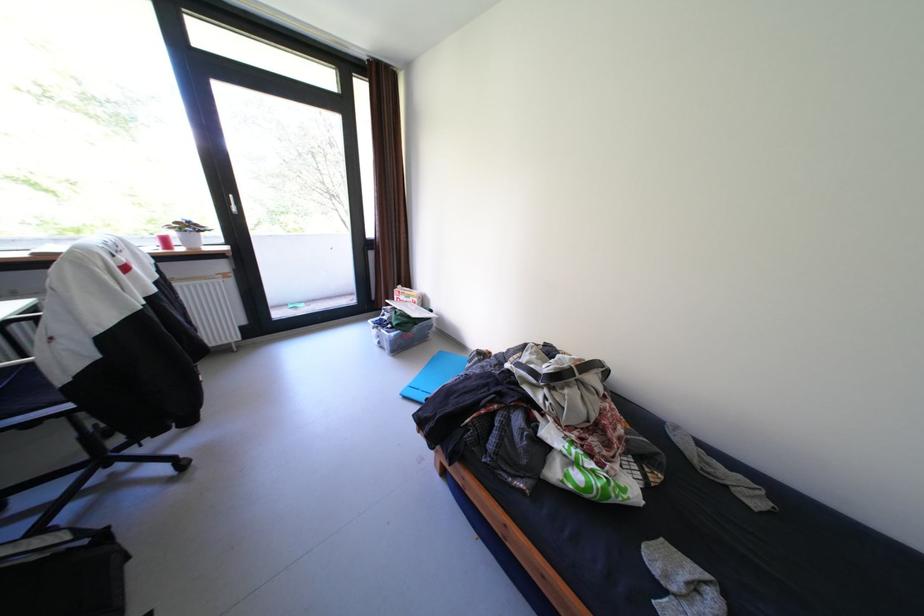
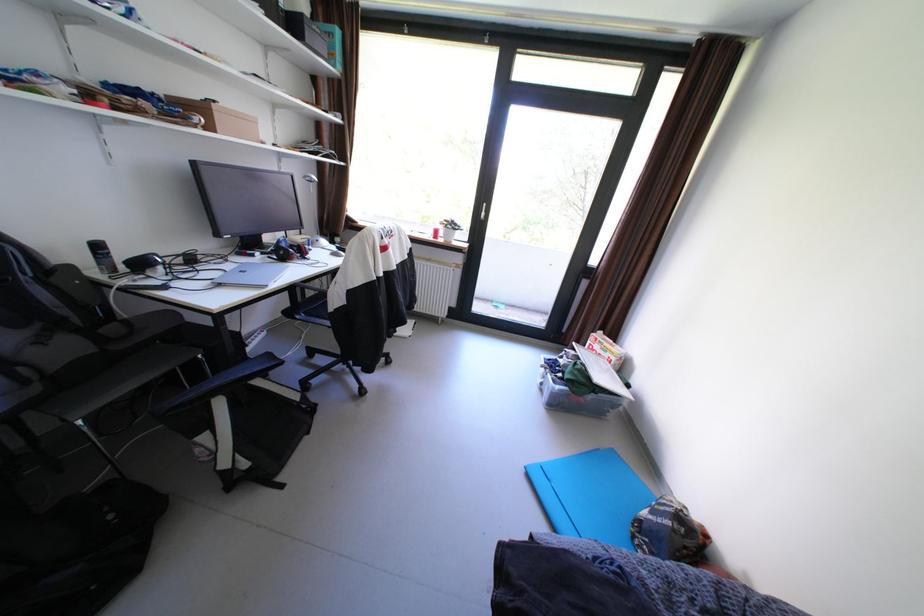
The point at (395, 318) is marked in the first image. Where is the corresponding point in the second image?

(572, 361)